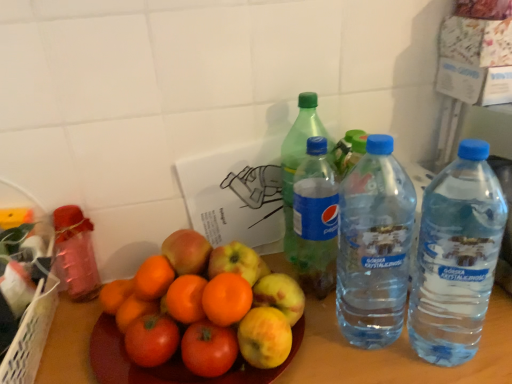
Question: Is green plastic bottle at center, which is the fourth bottle in right-to-left order, looking in the opposite direction of green plastic bottle at center, the 3th bottle viewed from the left?

Choices:
 (A) no
 (B) yes

Answer: (B)

Question: From the image's perspective, is green plastic bottle at center, which is the fourth bottle in right-to-left order, below green plastic bottle at center, arranged as the third bottle when viewed from the right?

Choices:
 (A) yes
 (B) no

Answer: (B)

Question: From a real-world perspective, does green plastic bottle at center, which is the fourth bottle in right-to-left order, sit lower than green plastic bottle at center, the 3th bottle viewed from the left?

Choices:
 (A) yes
 (B) no

Answer: (B)

Question: Can you confirm if green plastic bottle at center, which ranks as the 2th bottle in left-to-right order, is wider than green plastic bottle at center, arranged as the third bottle when viewed from the right?

Choices:
 (A) no
 (B) yes

Answer: (A)

Question: Does green plastic bottle at center, which is the fourth bottle in right-to-left order, have a lesser height compared to green plastic bottle at center, arranged as the third bottle when viewed from the right?

Choices:
 (A) yes
 (B) no

Answer: (B)

Question: From the image's perspective, does green plastic bottle at center, which is the fourth bottle in right-to-left order, appear higher than green plastic bottle at center, arranged as the third bottle when viewed from the right?

Choices:
 (A) yes
 (B) no

Answer: (A)

Question: Is green plastic bottle at center, which ranks as the 2th bottle in left-to-right order, shorter than orange matte at center?

Choices:
 (A) yes
 (B) no

Answer: (B)

Question: Is green plastic bottle at center, which is the fourth bottle in right-to-left order, with orange matte at center?

Choices:
 (A) yes
 (B) no

Answer: (B)

Question: Considering the relative positions of green plastic bottle at center, which ranks as the 2th bottle in left-to-right order, and orange matte at center in the image provided, is green plastic bottle at center, which ranks as the 2th bottle in left-to-right order, to the right of orange matte at center from the viewer's perspective?

Choices:
 (A) no
 (B) yes

Answer: (B)

Question: Is green plastic bottle at center, which ranks as the 2th bottle in left-to-right order, turned away from orange matte at center?

Choices:
 (A) no
 (B) yes

Answer: (A)

Question: Is green plastic bottle at center, which ranks as the 2th bottle in left-to-right order, far away from orange matte at center?

Choices:
 (A) no
 (B) yes

Answer: (A)

Question: From a real-world perspective, is green plastic bottle at center, which is the fourth bottle in right-to-left order, on top of orange matte at center?

Choices:
 (A) no
 (B) yes

Answer: (B)

Question: From a real-world perspective, is metallic pink bottle at left, which appears as the fifth bottle when viewed from the right, positioned under orange matte at center based on gravity?

Choices:
 (A) yes
 (B) no

Answer: (B)